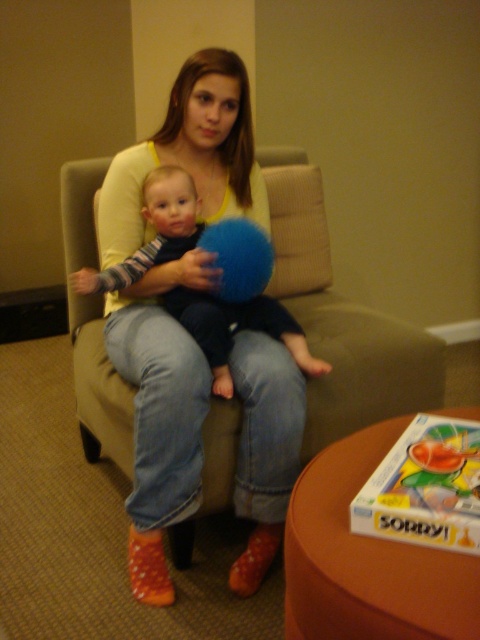
Who is more forward, (275, 332) or (255, 268)?

Point (255, 268) is more forward.

Identify the location of soft blue plush at center. (237, 330).

Where is `matte yellow sweater at center`? This screenshot has height=640, width=480. matte yellow sweater at center is located at coordinates (204, 419).

At what (x,y) coordinates should I click in order to perform the action: click on matte yellow sweater at center. Please return your answer as a coordinate pair (x, y). Image resolution: width=480 pixels, height=640 pixels. Looking at the image, I should click on (204, 419).

Can you confirm if matte yellow sweater at center is positioned below soft blue plush at center?

A: Indeed, matte yellow sweater at center is positioned under soft blue plush at center.

Can you confirm if matte yellow sweater at center is taller than soft blue plush at center?

Yes, matte yellow sweater at center is taller than soft blue plush at center.

This screenshot has height=640, width=480. In order to click on matte yellow sweater at center in this screenshot , I will do `click(204, 419)`.